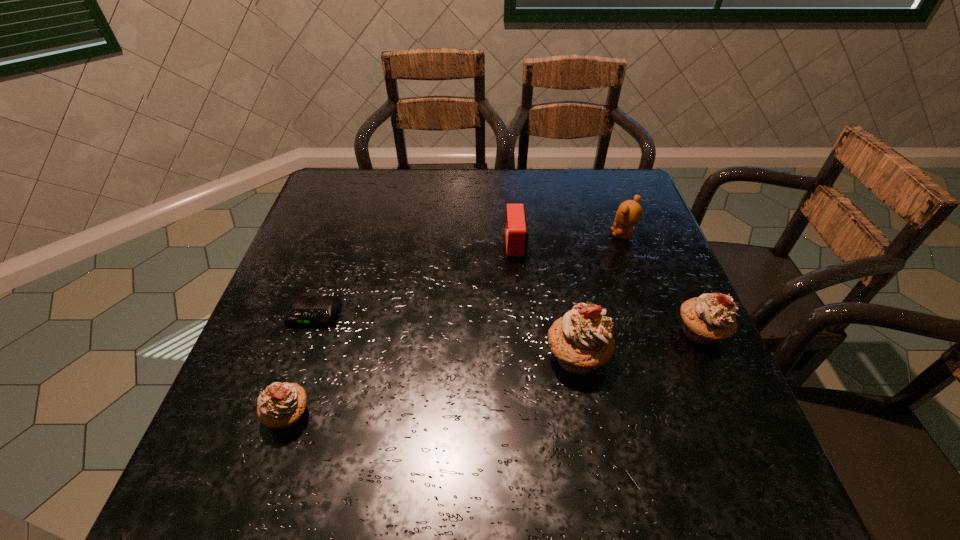
Where is `vacant area at the right edge of the desktop`? vacant area at the right edge of the desktop is located at coordinates (619, 252).

The image size is (960, 540). Identify the location of free space at the far right corner of the desktop. (595, 173).

The height and width of the screenshot is (540, 960). What are the coordinates of `free space between the farther alarm clock and the nearer alarm clock` in the screenshot? It's located at (415, 280).

Where is `free space that is in between the nearest object and the shortest object`? The width and height of the screenshot is (960, 540). free space that is in between the nearest object and the shortest object is located at coordinates (300, 365).

Find the location of `unoccupied area between the second tallest cupcake and the shortest cupcake`. unoccupied area between the second tallest cupcake and the shortest cupcake is located at coordinates (494, 373).

In order to click on free space between the right alarm clock and the fifth object from left to right in this screenshot , I will do `click(569, 240)`.

The image size is (960, 540). In order to click on free space between the taller alarm clock and the rightmost object in this screenshot , I will do `click(609, 288)`.

Image resolution: width=960 pixels, height=540 pixels. Find the location of `free space that is in between the shortest cupcake and the fifth object from left to right`. free space that is in between the shortest cupcake and the fifth object from left to right is located at coordinates (456, 325).

Find the location of a particular element. vacant space that's between the tallest cupcake and the rightmost cupcake is located at coordinates [x=638, y=344].

Find the location of `free point between the tallest object and the fourth object from right to left`. free point between the tallest object and the fourth object from right to left is located at coordinates (546, 300).